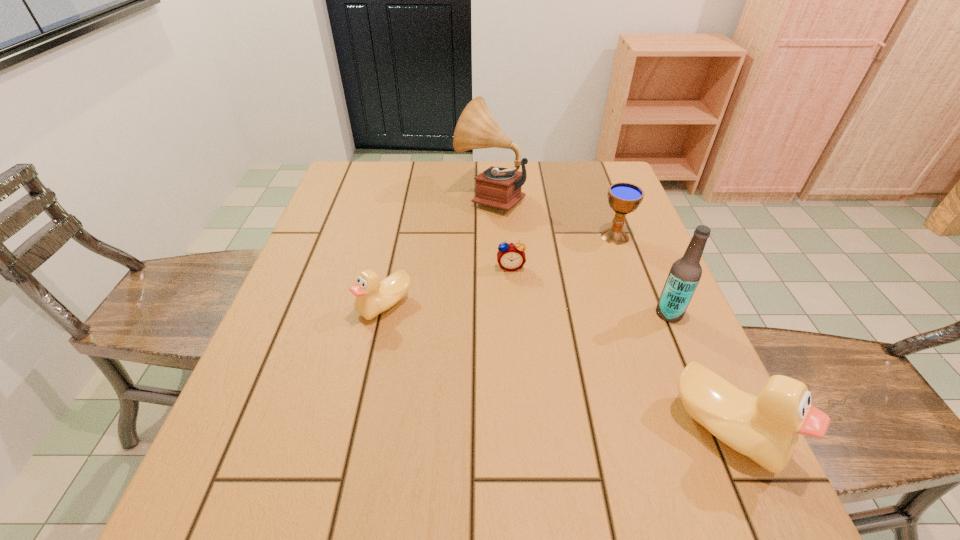
Image resolution: width=960 pixels, height=540 pixels. What are the coordinates of `vacant space at the left edge of the desktop` in the screenshot? It's located at pyautogui.click(x=322, y=301).

In the image, there is a desktop. At what (x,y) coordinates should I click in order to perform the action: click on free space at the right edge. Please return your answer as a coordinate pair (x, y). The height and width of the screenshot is (540, 960). Looking at the image, I should click on (680, 335).

At what (x,y) coordinates should I click in order to perform the action: click on free region at the near left corner. Please return your answer as a coordinate pair (x, y). Looking at the image, I should click on (226, 435).

Locate an element on the screen. free area in between the chalice and the shorter duck is located at coordinates (499, 271).

Where is `vacant point located between the fifth nearest object and the third tallest object`? This screenshot has height=540, width=960. vacant point located between the fifth nearest object and the third tallest object is located at coordinates (670, 333).

The height and width of the screenshot is (540, 960). I want to click on free spot between the second farthest object and the beer bottle, so click(642, 275).

Where is `vacant area that lies between the second tallest object and the second farthest object`? vacant area that lies between the second tallest object and the second farthest object is located at coordinates (642, 275).

Image resolution: width=960 pixels, height=540 pixels. I want to click on vacant point located between the right duck and the phonograph record, so click(608, 313).

Find the location of a particular element. unoccupied area between the beer bottle and the fifth nearest object is located at coordinates (642, 275).

Where is `vacant space in between the phonograph record and the chalice`? This screenshot has width=960, height=540. vacant space in between the phonograph record and the chalice is located at coordinates (553, 216).